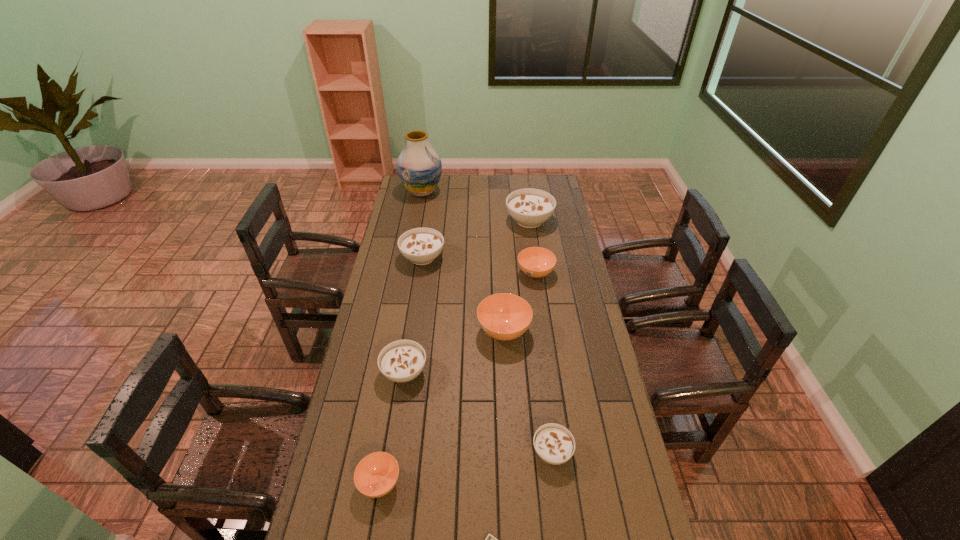
Locate an element on the screen. The width and height of the screenshot is (960, 540). the leftmost peach soup bowl is located at coordinates (376, 474).

I want to click on the smallest peach soup bowl, so click(x=376, y=474).

Identify the location of the nearest white soup bowl. The height and width of the screenshot is (540, 960). (554, 444).

In order to click on vacant space positioned 0.070m on the back of the tallest object in this screenshot , I will do `click(425, 175)`.

The image size is (960, 540). I want to click on free space located 0.120m on the front of the farthest soup bowl, so click(x=534, y=251).

At what (x,y) coordinates should I click in order to perform the action: click on vacant space located 0.160m on the front of the second farthest peach soup bowl. Please return your answer as a coordinate pair (x, y). The height and width of the screenshot is (540, 960). Looking at the image, I should click on (507, 389).

You are a GUI agent. You are given a task and a screenshot of the screen. Output one action in this format:
    pyautogui.click(x=<x>, y=<y>)
    Task: Click on the vacant space located on the right of the third nearest white soup bowl
    
    Given the screenshot: What is the action you would take?
    pyautogui.click(x=527, y=258)

Where is `vacant area situated 0.100m on the front of the second smallest peach soup bowl`? vacant area situated 0.100m on the front of the second smallest peach soup bowl is located at coordinates (540, 302).

The width and height of the screenshot is (960, 540). I want to click on free space located 0.060m on the front of the second smallest white soup bowl, so click(x=398, y=407).

Image resolution: width=960 pixels, height=540 pixels. In order to click on vacant position located on the back of the nearest peach soup bowl in this screenshot , I will do `click(395, 393)`.